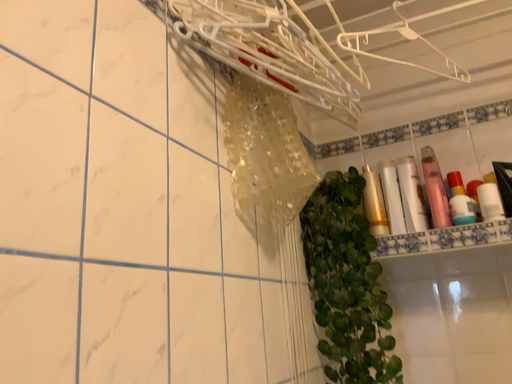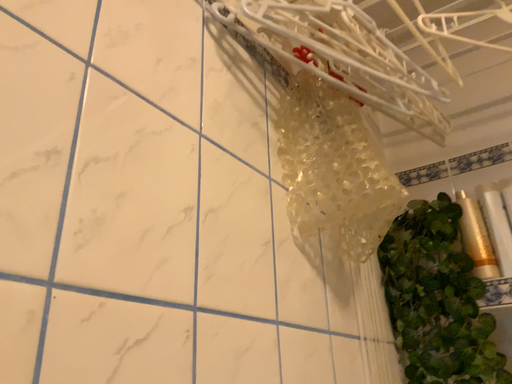
Question: How did the camera likely rotate when shooting the video?

Choices:
 (A) rotated left
 (B) rotated right

Answer: (A)